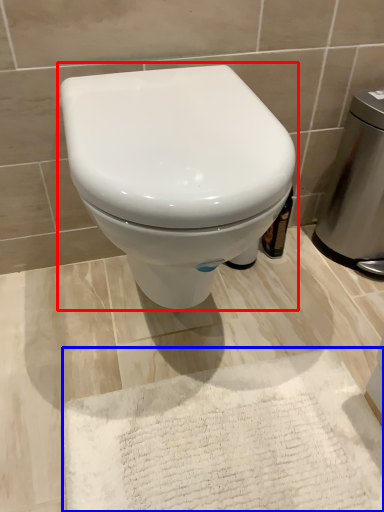
Question: Which object is further to the camera taking this photo, toilet (highlighted by a red box) or bath mat (highlighted by a blue box)?

Choices:
 (A) toilet
 (B) bath mat

Answer: (B)